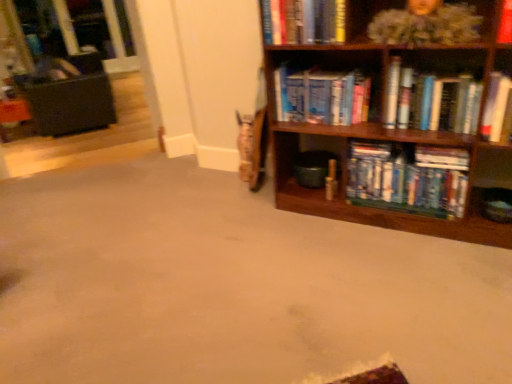
Question: Is hardcover book at right, the 4th book when ordered from top to bottom, positioned in front of hardcover books at center, placed as the 5th book when sorted from top to bottom?

Choices:
 (A) yes
 (B) no

Answer: (A)

Question: From the image's perspective, is hardcover book at right, the 4th book when ordered from top to bottom, below hardcover books at center, which is the 1th book in bottom-to-top order?

Choices:
 (A) no
 (B) yes

Answer: (A)

Question: Could you tell me if hardcover book at right, the second book ordered from the bottom, is facing hardcover books at center, placed as the 5th book when sorted from top to bottom?

Choices:
 (A) yes
 (B) no

Answer: (B)

Question: Considering the relative sizes of hardcover book at right, the second book ordered from the bottom, and hardcover books at center, which is the 1th book in bottom-to-top order, in the image provided, is hardcover book at right, the second book ordered from the bottom, taller than hardcover books at center, which is the 1th book in bottom-to-top order,?

Choices:
 (A) yes
 (B) no

Answer: (B)

Question: From a real-world perspective, is hardcover book at right, the second book ordered from the bottom, positioned over hardcover books at center, which is the 1th book in bottom-to-top order, based on gravity?

Choices:
 (A) yes
 (B) no

Answer: (A)

Question: From their relative heights in the image, would you say hardcover book at upper center, arranged as the 5th book when ordered from the bottom, is taller or shorter than black leather swivel chair at left?

Choices:
 (A) tall
 (B) short

Answer: (B)

Question: From the image's perspective, is hardcover book at upper center, which ranks as the 1th book in top-to-bottom order, positioned above or below black leather swivel chair at left?

Choices:
 (A) above
 (B) below

Answer: (B)

Question: Looking at their shapes, would you say hardcover book at upper center, arranged as the 5th book when ordered from the bottom, is wider or thinner than black leather swivel chair at left?

Choices:
 (A) thin
 (B) wide

Answer: (A)

Question: Visually, is hardcover book at upper center, which ranks as the 1th book in top-to-bottom order, positioned to the left or to the right of black leather swivel chair at left?

Choices:
 (A) right
 (B) left

Answer: (A)

Question: From the image's perspective, is hardcover books at center, placed as the 5th book when sorted from top to bottom, above or below hardcover book at upper center, arranged as the 5th book when ordered from the bottom?

Choices:
 (A) above
 (B) below

Answer: (B)

Question: From a real-world perspective, relative to hardcover book at upper center, which ranks as the 1th book in top-to-bottom order, is hardcover books at center, placed as the 5th book when sorted from top to bottom, vertically above or below?

Choices:
 (A) below
 (B) above

Answer: (A)

Question: Would you say hardcover books at center, which is the 1th book in bottom-to-top order, is to the left or to the right of hardcover book at upper center, arranged as the 5th book when ordered from the bottom, in the picture?

Choices:
 (A) left
 (B) right

Answer: (B)

Question: Looking at their shapes, would you say hardcover books at center, which is the 1th book in bottom-to-top order, is wider or thinner than hardcover book at upper center, arranged as the 5th book when ordered from the bottom?

Choices:
 (A) wide
 (B) thin

Answer: (B)

Question: Considering the positions of point click(x=94, y=81) and point click(x=454, y=51), is point click(x=94, y=81) closer or farther from the camera than point click(x=454, y=51)?

Choices:
 (A) farther
 (B) closer

Answer: (A)

Question: In the image, is black leather swivel chair at left on the left side or the right side of wooden bookcase at right?

Choices:
 (A) left
 (B) right

Answer: (A)